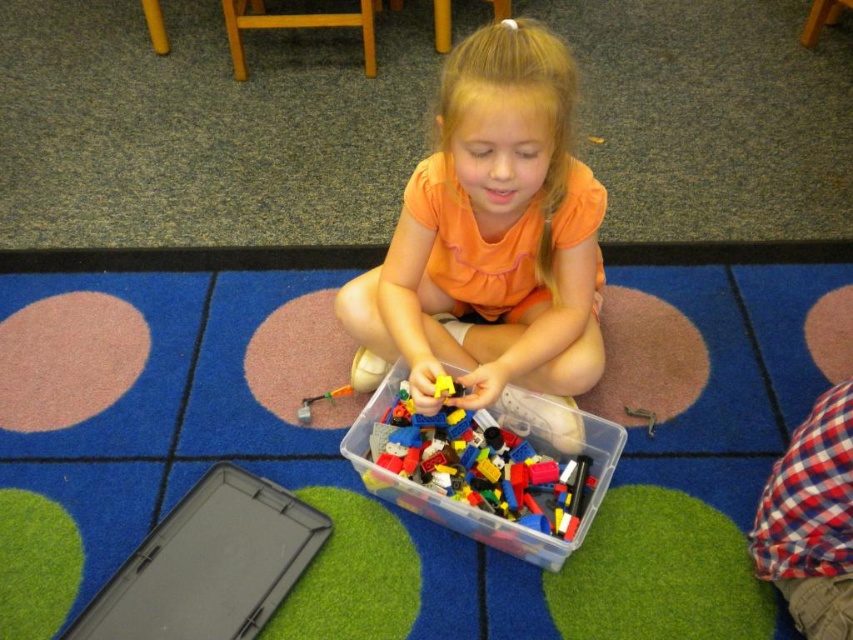
Question: Which object is positioned closest to the red plaid shirt at lower right?

Choices:
 (A) translucent plastic container at center
 (B) orange matte shirt at center

Answer: (A)

Question: Is blue carpet at center smaller than translucent plastic container at center?

Choices:
 (A) yes
 (B) no

Answer: (B)

Question: Which point is farther to the camera?

Choices:
 (A) blue carpet at center
 (B) orange matte shirt at center
 (C) translucent plastic container at center

Answer: (A)

Question: Can you confirm if blue carpet at center is wider than orange matte shirt at center?

Choices:
 (A) yes
 (B) no

Answer: (A)

Question: Can you confirm if blue carpet at center is positioned below orange matte shirt at center?

Choices:
 (A) no
 (B) yes

Answer: (B)

Question: Among these objects, which one is nearest to the camera?

Choices:
 (A) orange matte shirt at center
 (B) translucent plastic container at center
 (C) red plaid shirt at lower right
 (D) blue carpet at center

Answer: (A)